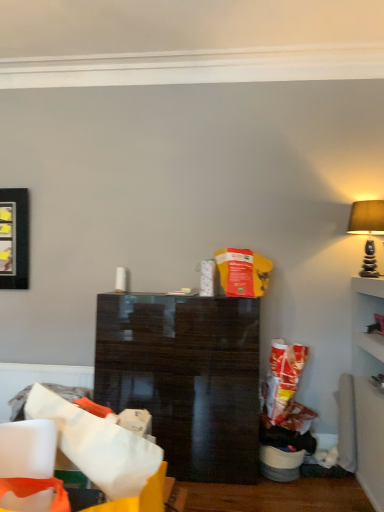
Question: Is matte beige lampshade at upper right spatially inside white paper bag at lower left, or outside of it?

Choices:
 (A) inside
 (B) outside

Answer: (B)

Question: Based on their sizes in the image, would you say matte beige lampshade at upper right is bigger or smaller than white paper bag at lower left?

Choices:
 (A) big
 (B) small

Answer: (B)

Question: Considering the real-world distances, which object is closest to the white paper bag at lower left?

Choices:
 (A) glossy dark wood cabinet at center
 (B) matte black picture frame at left
 (C) matte beige lampshade at upper right

Answer: (A)

Question: Which object is positioned farthest from the glossy dark wood cabinet at center?

Choices:
 (A) white paper bag at lower left
 (B) matte beige lampshade at upper right
 (C) matte black picture frame at left

Answer: (A)